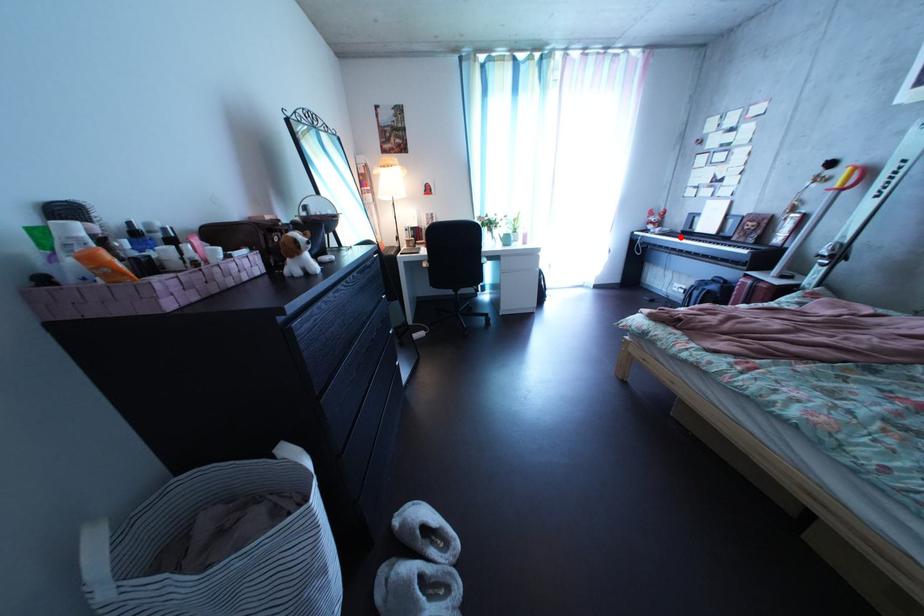
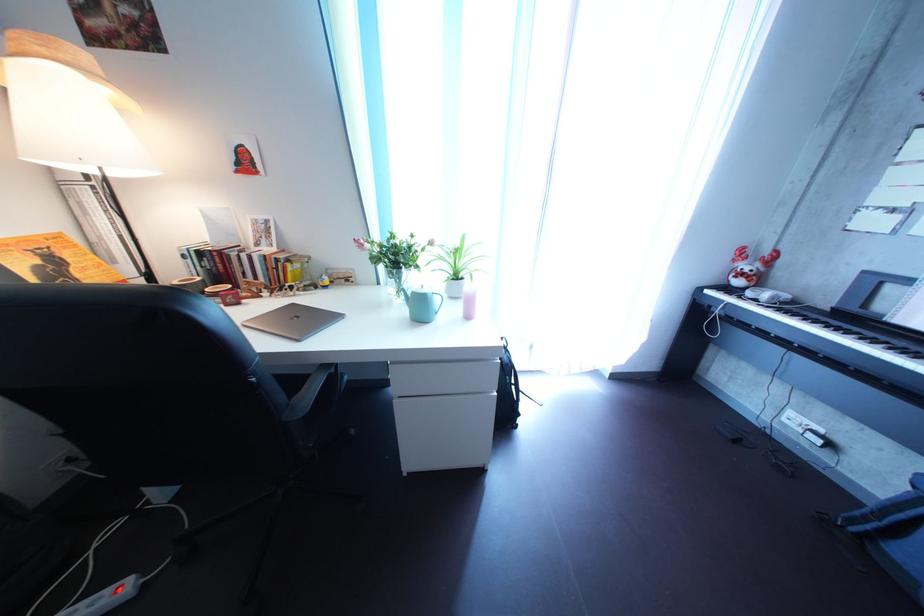
The point at the highlighted location is marked in the first image. Where is the corresponding point in the second image?

(801, 304)